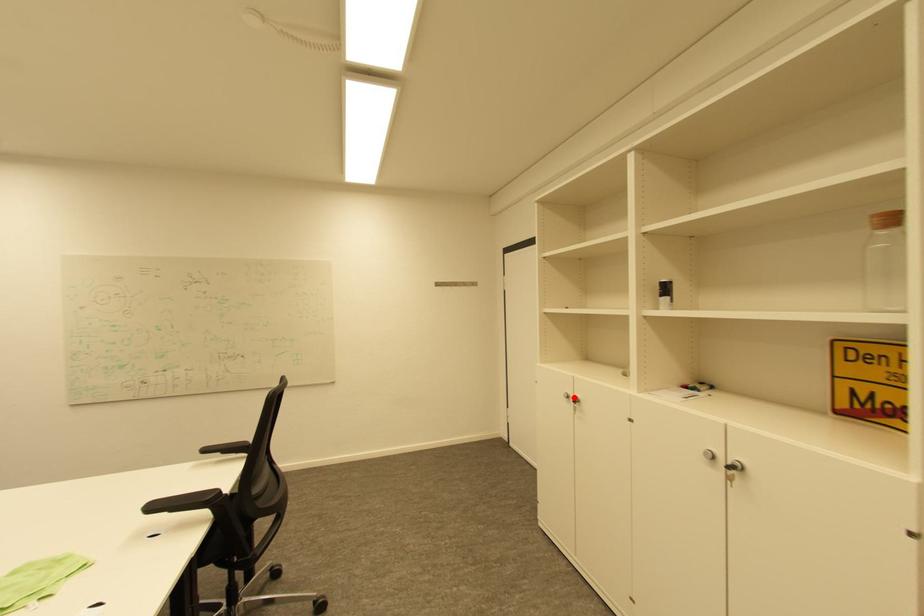
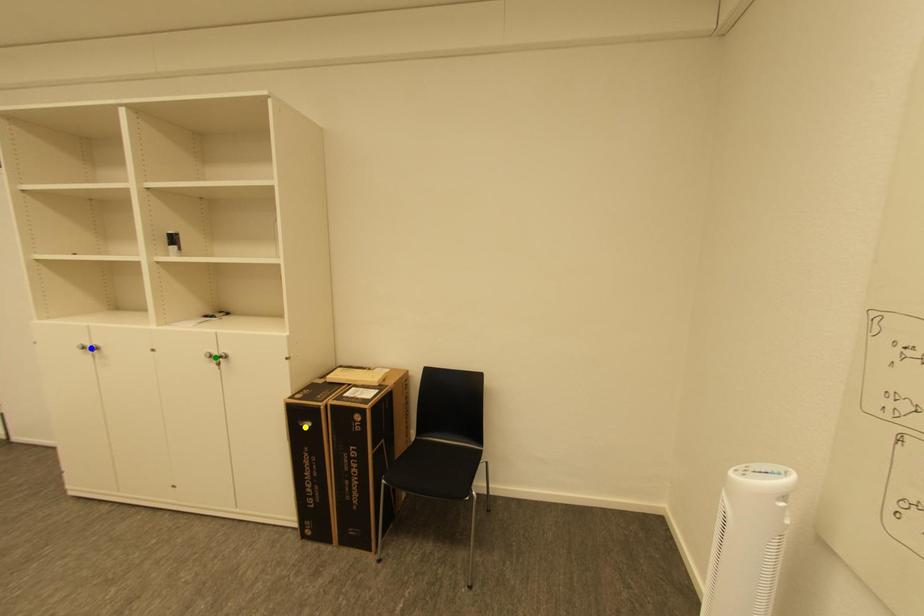
Question: I am providing you with two images of the same scene from different viewpoints. A red point is marked on the first image. You are given multiple points on the second image. In image 2, which mark is for the same physical point as the one in image 1?

Choices:
 (A) blue point
 (B) yellow point
 (C) green point

Answer: (A)